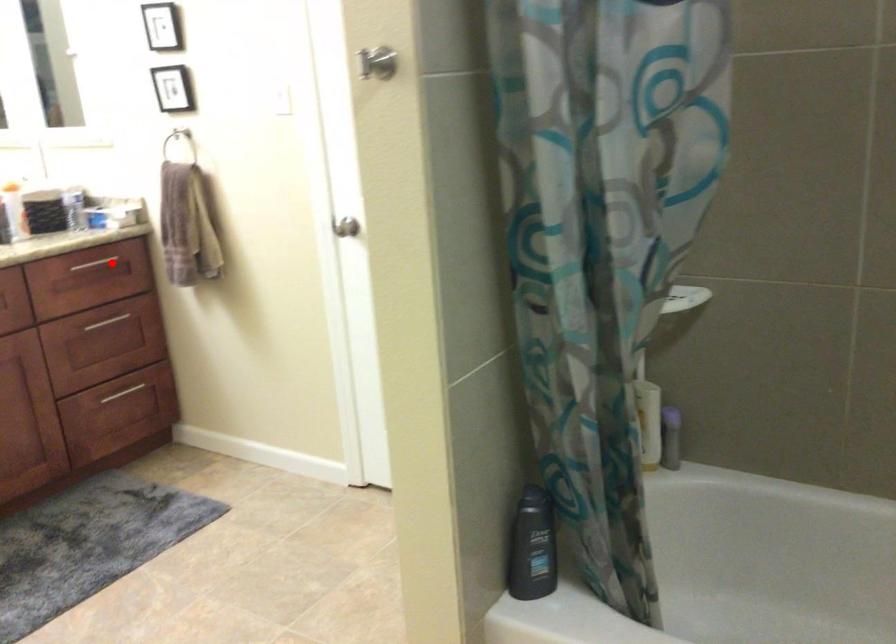
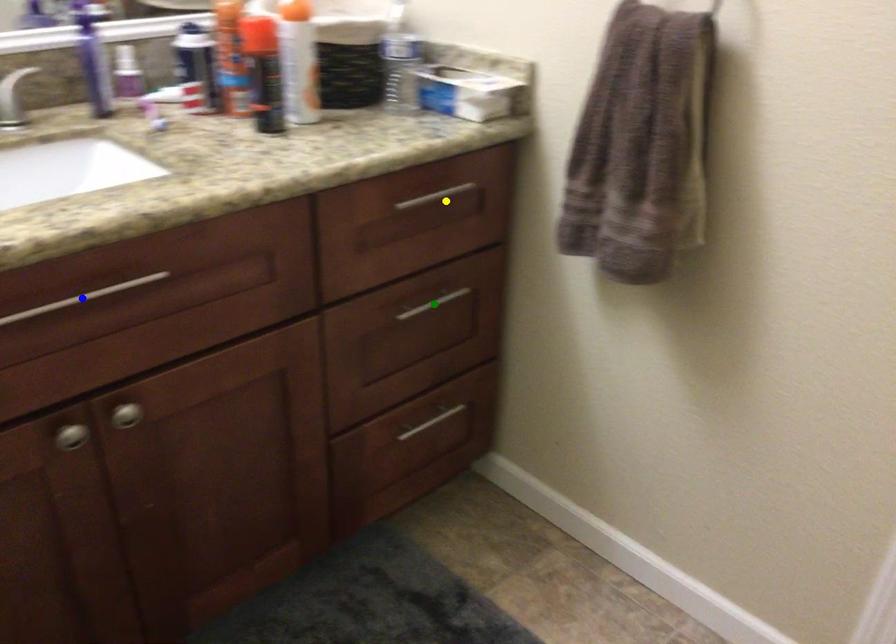
Question: I am providing you with two images of the same scene from different viewpoints. A red point is marked on the first image. You are given multiple points on the second image. Can you choose the point in image 2 that corresponds to the point in image 1?

Choices:
 (A) yellow point
 (B) blue point
 (C) green point

Answer: (A)